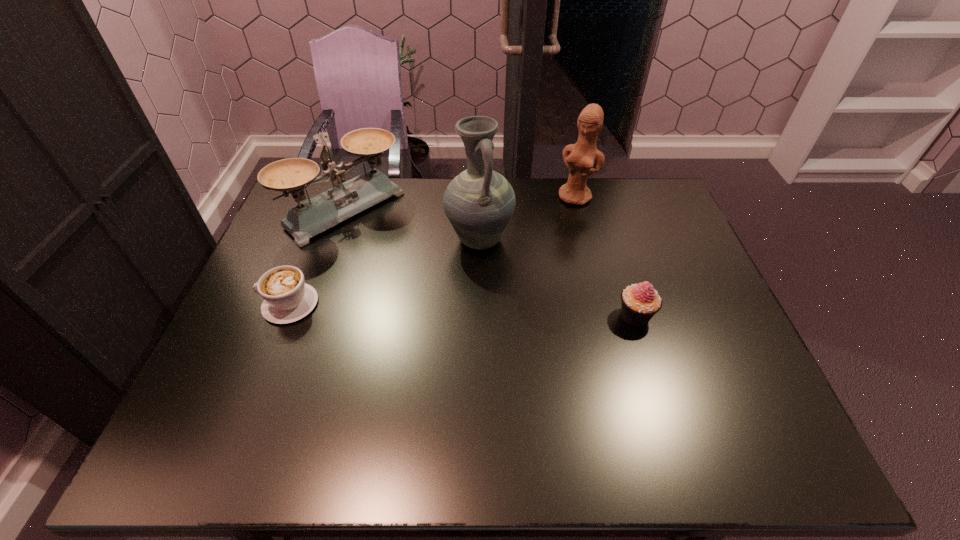
Locate an element on the screen. The image size is (960, 540). free space that is in between the cappuccino and the pitcher is located at coordinates (384, 272).

Identify the location of free space that is in between the third tallest object and the shortest object. The width and height of the screenshot is (960, 540). pos(318,257).

Where is `vacant area that lies between the fourth shortest object and the third object from left to right`? Image resolution: width=960 pixels, height=540 pixels. vacant area that lies between the fourth shortest object and the third object from left to right is located at coordinates (528, 218).

You are a GUI agent. You are given a task and a screenshot of the screen. Output one action in this format:
    pyautogui.click(x=<x>, y=<y>)
    Task: Click on the vacant region between the third object from right to left and the cappuccino
    
    Given the screenshot: What is the action you would take?
    pyautogui.click(x=384, y=272)

Identify the location of empty location between the cappuccino and the fourth tallest object. This screenshot has width=960, height=540. (462, 310).

At what (x,y) coordinates should I click in order to perform the action: click on vacant area that lies between the cupcake and the tallest object. Please return your answer as a coordinate pair (x, y). Looking at the image, I should click on (557, 278).

Find the location of a particular element. This screenshot has height=540, width=960. free space that is in between the pitcher and the second tallest object is located at coordinates (528, 218).

The height and width of the screenshot is (540, 960). I want to click on free spot between the cupcake and the pitcher, so click(557, 278).

This screenshot has width=960, height=540. What are the coordinates of `object that is the closest to the scale` in the screenshot? It's located at (287, 298).

Locate an element on the screen. This screenshot has height=540, width=960. the closest object to the figurine is located at coordinates (479, 203).